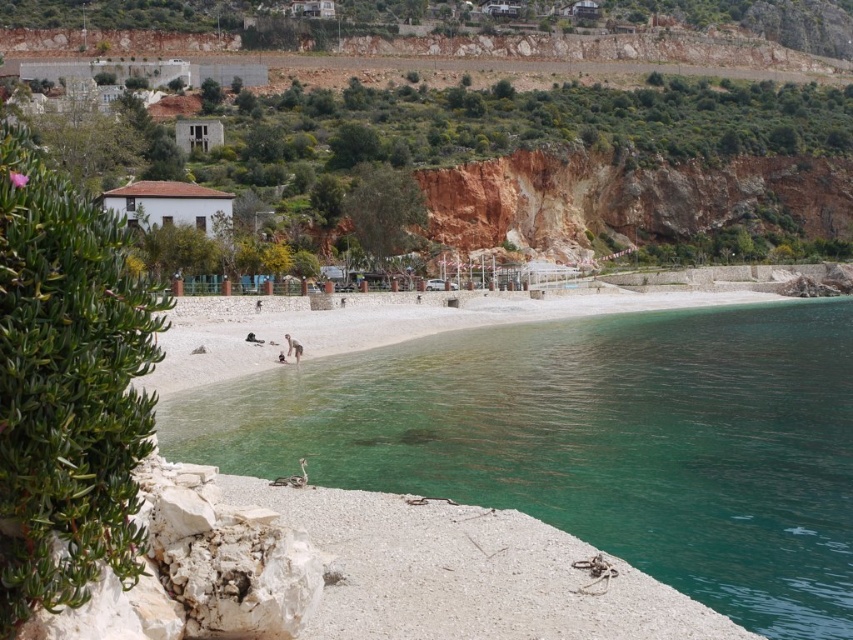
You are standing at the cliff face on the right side of the beach. You see two points marked on the beach. Which point is closer to you, point (236, 417) or point (323, 522)?

Point (323, 522) is closer to you because it is in front of point (236, 417).

You are a photographer planning to capture the entire scene of the green smooth water at center and the white fabric person at center in one shot. Can you fit both objects in the frame without zooming in? Explain your reasoning based on their sizes.

The green smooth water at center is bigger than the white fabric person at center, so it is possible to fit both objects in the frame without zooming in because the water occupies more space, allowing the person to be included alongside it.

You are standing at the edge of the rocky outcrop with sparse vegetation on the left side. You see the white gravel at lower left and the white fabric person at center. Which object is wider from your current viewpoint?

The white gravel at lower left might be wider than white fabric person at center according to the description.